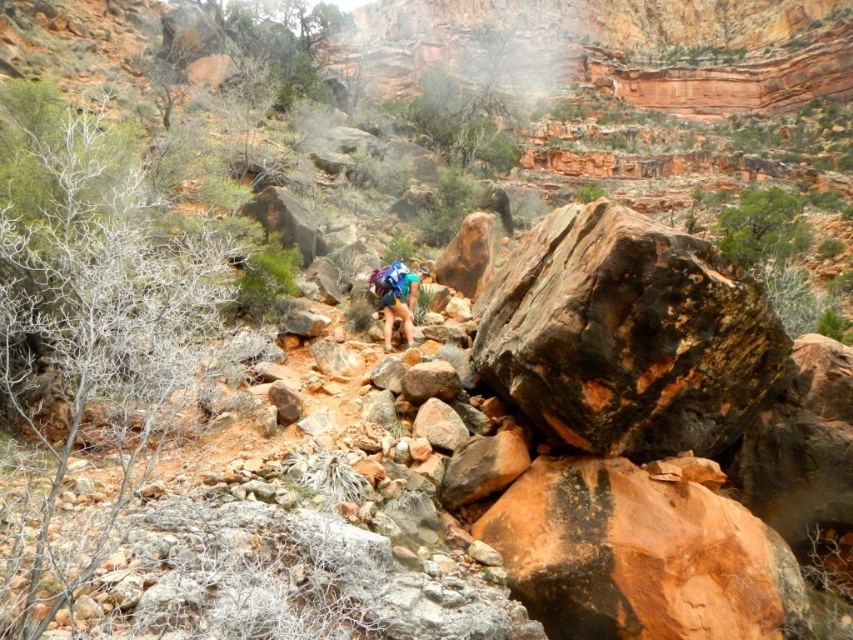
Who is taller, rusty brown rock at right or blue fabric backpack at center?

rusty brown rock at right is taller.

Consider the image. Is rusty brown rock at right positioned in front of blue fabric backpack at center?

Yes, rusty brown rock at right is in front of blue fabric backpack at center.

Is point (596, 369) closer to viewer compared to point (378, 282)?

That is True.

The width and height of the screenshot is (853, 640). Find the location of `rusty brown rock at right`. rusty brown rock at right is located at coordinates (627, 336).